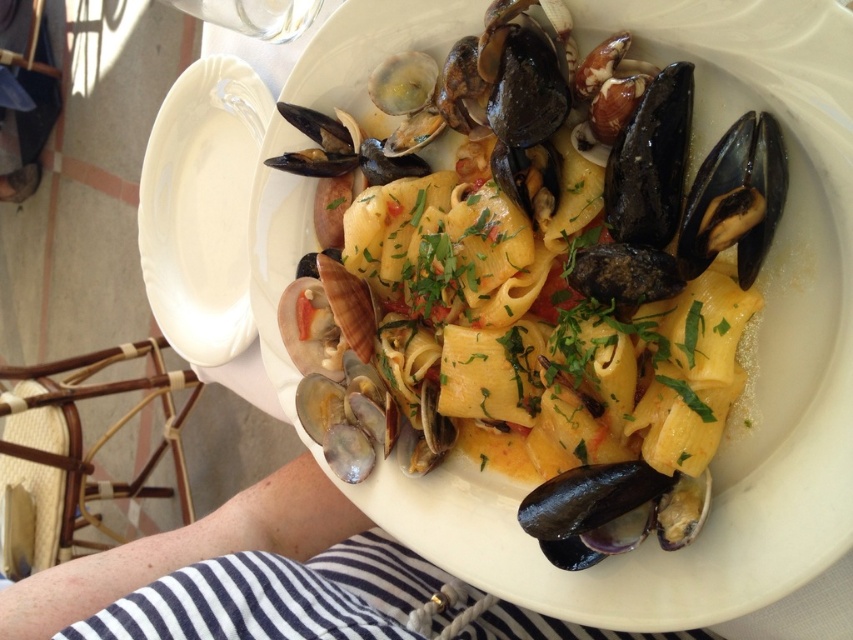
Is point (184, 234) in front of point (689, 531)?

No.

Is white glossy plate at upper left to the left of shiny dark blue shell at bottom right from the viewer's perspective?

Correct, you'll find white glossy plate at upper left to the left of shiny dark blue shell at bottom right.

Is point (218, 86) positioned before point (525, 525)?

No, (218, 86) is behind (525, 525).

Identify the location of white glossy plate at upper left. (202, 208).

Which is above, yellow matte pasta at center or shiny dark blue shell at bottom right?

yellow matte pasta at center

Is yellow matte pasta at center to the left of shiny dark blue shell at bottom right from the viewer's perspective?

Correct, you'll find yellow matte pasta at center to the left of shiny dark blue shell at bottom right.

Is point (500, 593) closer to camera compared to point (573, 544)?

No, it is not.

Where is `yellow matte pasta at center`? yellow matte pasta at center is located at coordinates (753, 344).

Does point (442, 42) lie behind point (206, 340)?

No, (442, 42) is in front of (206, 340).

From the picture: Is yellow matte pasta at center to the right of white glossy plate at upper left from the viewer's perspective?

Indeed, yellow matte pasta at center is positioned on the right side of white glossy plate at upper left.

The image size is (853, 640). I want to click on yellow matte pasta at center, so click(x=753, y=344).

The width and height of the screenshot is (853, 640). I want to click on yellow matte pasta at center, so click(x=753, y=344).